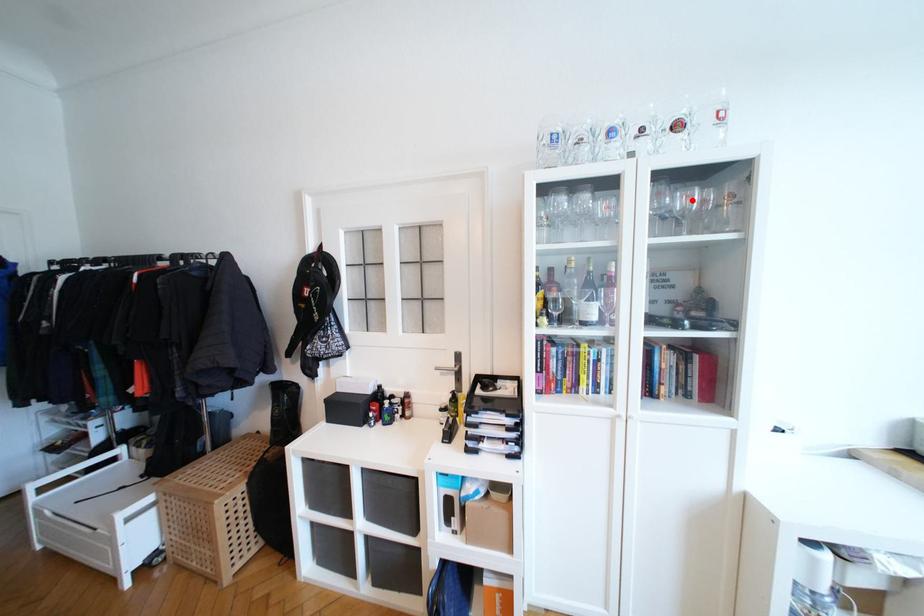
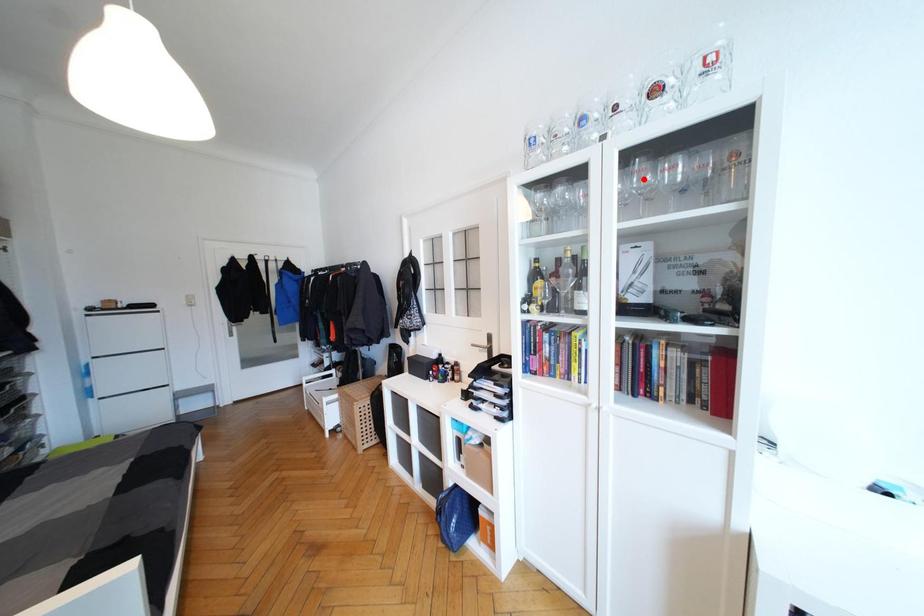
I am providing you with two images of the same scene from different viewpoints. A red point is marked on the first image and another point is marked on the second image. Do the highlighted points in image1 and image2 indicate the same real-world spot?

No